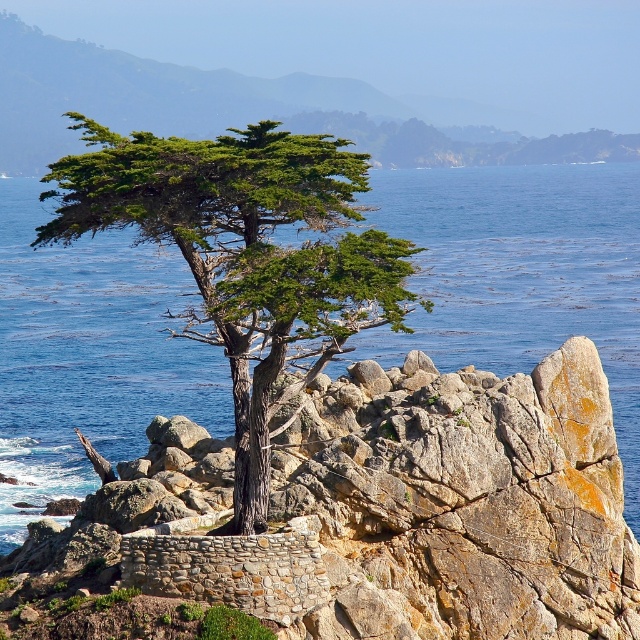
Does rustic stone wall at center have a lesser width compared to green textured cypress tree at center?

Indeed, rustic stone wall at center has a lesser width compared to green textured cypress tree at center.

Who is shorter, rustic stone wall at center or green textured cypress tree at center?

rustic stone wall at center is shorter.

Does point (515, 499) come closer to viewer compared to point (189, 176)?

No, it is behind (189, 176).

Find the location of a particular element. Image resolution: width=640 pixels, height=640 pixels. rustic stone wall at center is located at coordinates (364, 518).